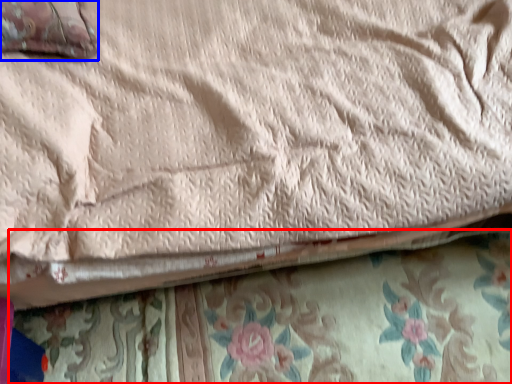
Question: Among these objects, which one is farthest to the camera, blanket (highlighted by a red box) or pillow (highlighted by a blue box)?

Choices:
 (A) blanket
 (B) pillow

Answer: (A)